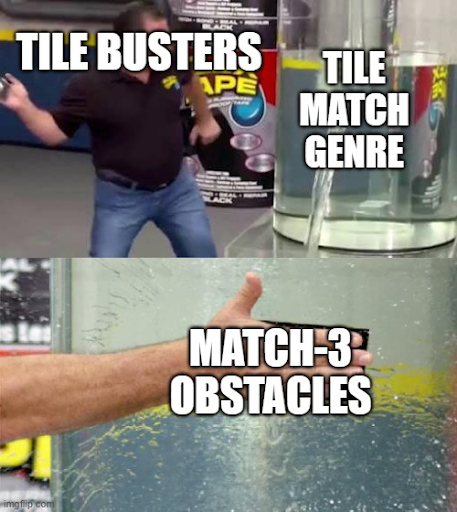
The height and width of the screenshot is (512, 457). Find the location of `gray floor`. gray floor is located at coordinates (230, 222).